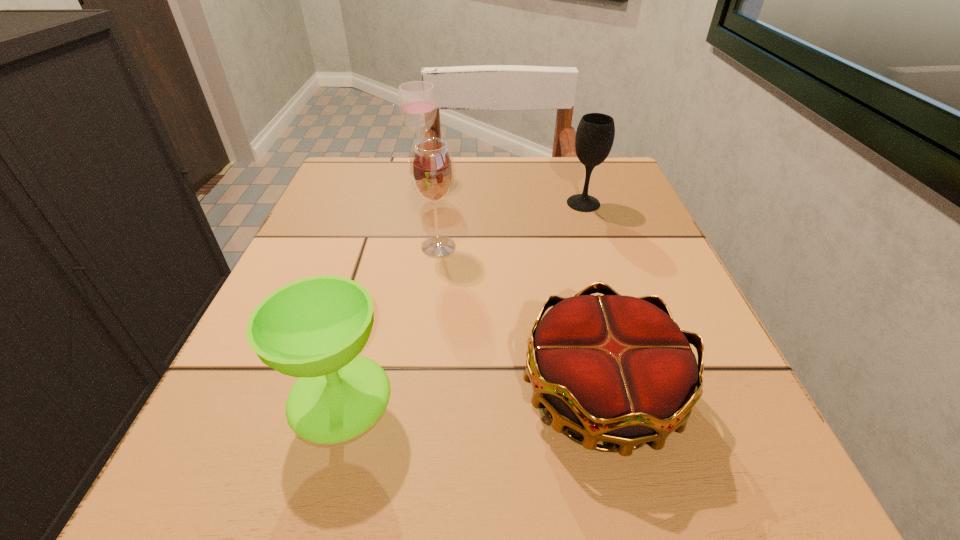
The width and height of the screenshot is (960, 540). Identify the location of vacant space situated 0.320m on the back of the nearest wineglass. (387, 225).

Where is `free point located on the back of the crown`? free point located on the back of the crown is located at coordinates (573, 280).

Locate an element on the screen. This screenshot has height=540, width=960. wineglass that is at the near edge is located at coordinates (314, 328).

This screenshot has width=960, height=540. Identify the location of crown located at the near edge. click(x=615, y=368).

You are a GUI agent. You are given a task and a screenshot of the screen. Output one action in this format:
    pyautogui.click(x=<x>, y=<y>)
    Task: Click on the object present at the left edge
    This screenshot has height=540, width=960.
    Given the screenshot: What is the action you would take?
    pyautogui.click(x=314, y=328)

This screenshot has height=540, width=960. In order to click on wineglass present at the right edge in this screenshot , I will do tap(595, 133).

This screenshot has height=540, width=960. In order to click on crown located at the right edge in this screenshot , I will do `click(615, 368)`.

This screenshot has width=960, height=540. What are the coordinates of `object situated at the near left corner` in the screenshot? It's located at (314, 328).

I want to click on object situated at the far right corner, so click(595, 133).

The image size is (960, 540). In order to click on object positioned at the near right corner in this screenshot , I will do click(615, 368).